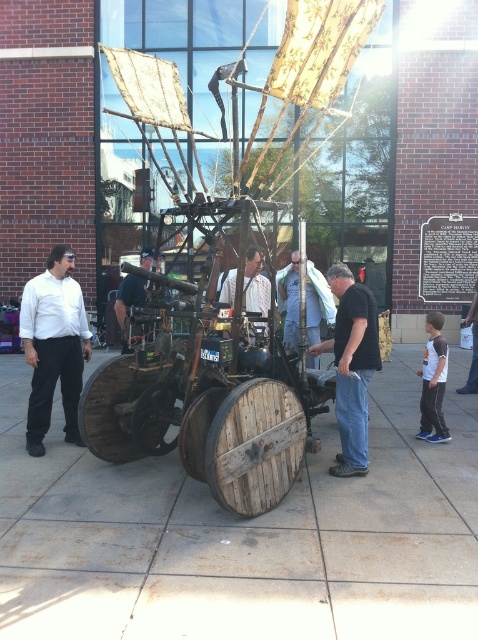
You are an engineer inspecting a historical steampunk exhibit. You notice the wooden cart at center and the matte white shirt at left. Which object would require more space to store in a museum display case?

The wooden cart at center is larger in size than the matte white shirt at left, so it would require more space to store in a museum display case.

You are a tailor measuring clothing items. You have a matte white shirt at left and a black leather jacket at center. Which clothing item has a larger width?

The matte white shirt at left might be wider than black leather jacket at center, so it is possible that the matte white shirt at left has a larger width.

You are standing in front of the mechanical structure and want to reach the point at coordinates point (x=47, y=296). If your current distance to that point is 6.22 meters, can you safely walk straight to it without any obstacles?

The point (x=47, y=296) is 6.22 meters away from the viewer. Since there are no obstacles mentioned in the scene description, you can safely walk straight to it.